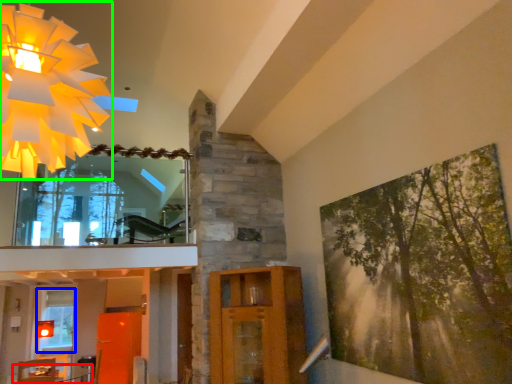
Question: Which is nearer to the table (highlighted by a red box)? window (highlighted by a blue box) or chandelier (highlighted by a green box).

Choices:
 (A) window
 (B) chandelier

Answer: (A)